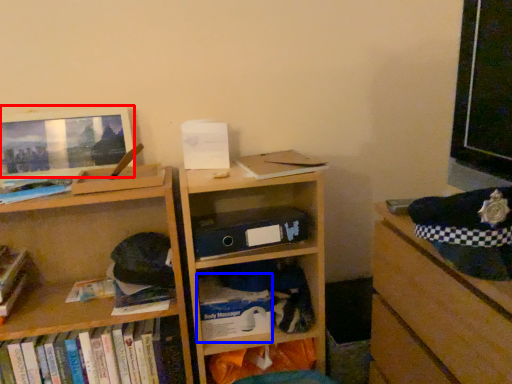
Question: Which object is closer to the camera taking this photo, computer monitor (highlighted by a red box) or paperback book (highlighted by a blue box)?

Choices:
 (A) computer monitor
 (B) paperback book

Answer: (A)